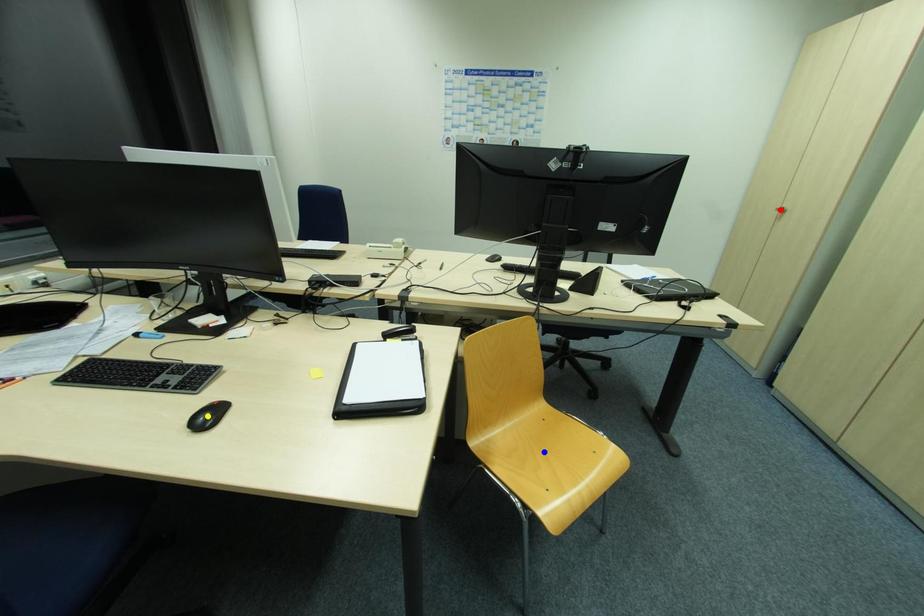
Order these from farthest to nearest:
blue point
red point
yellow point

1. red point
2. blue point
3. yellow point